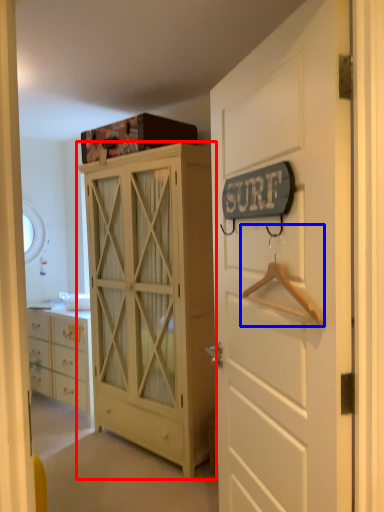
Question: Which object is further to the camera taking this photo, cabinetry (highlighted by a red box) or hanger (highlighted by a blue box)?

Choices:
 (A) cabinetry
 (B) hanger

Answer: (A)